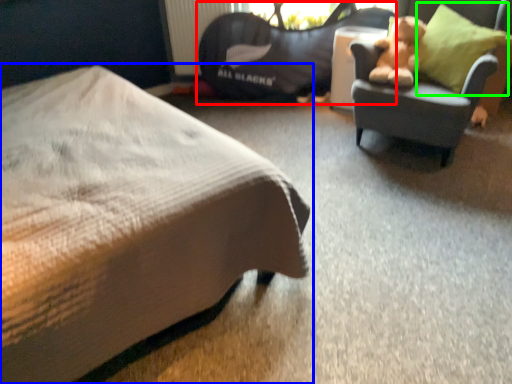
Question: Based on their relative distances, which object is nearer to bean bag chair (highlighted by a red box)? Choose from bed (highlighted by a blue box) and throw pillow (highlighted by a green box).

Choices:
 (A) bed
 (B) throw pillow

Answer: (B)